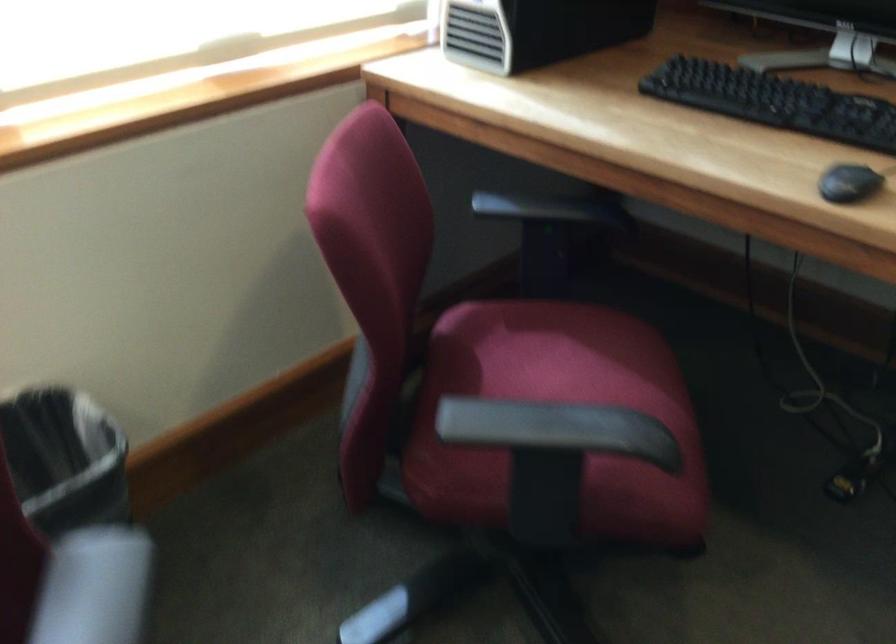
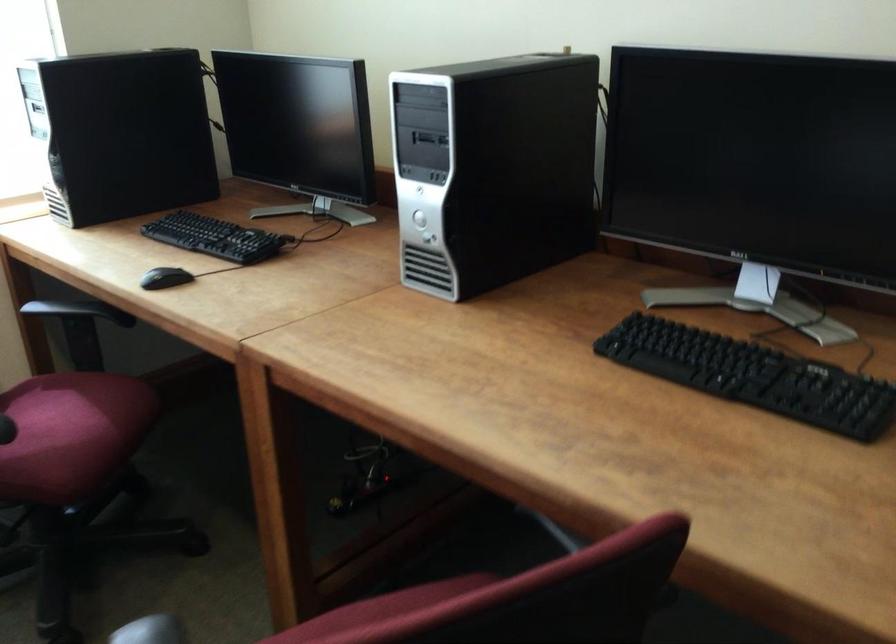
In the scene shown: What movement of the cameraman would produce the second image?

The movement direction of the cameraman is right, backward.